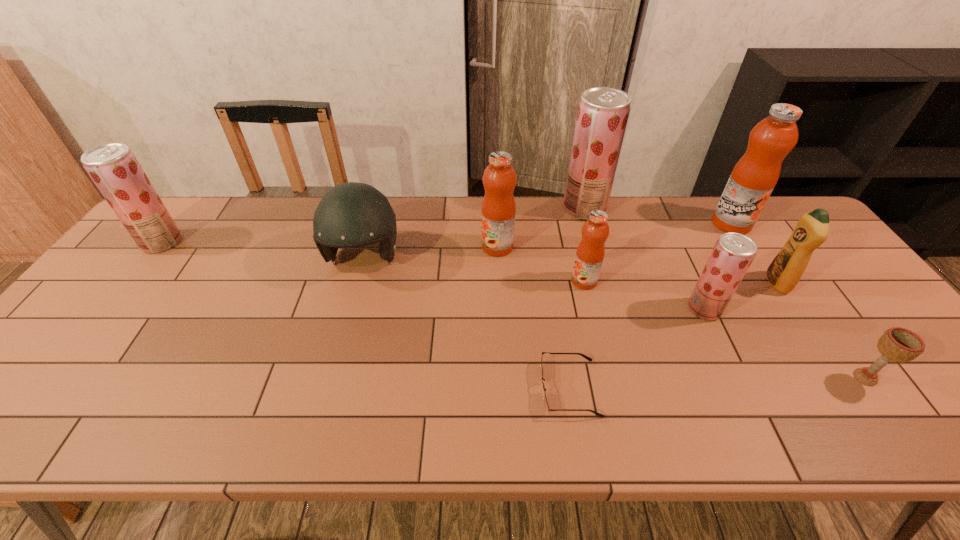
Identify the location of the second closest strawberry fruit juice to the second shortest object. This screenshot has height=540, width=960. (603, 112).

Locate an element on the screen. This screenshot has width=960, height=540. strawberry fruit juice that can be found as the closest to the fourth object from right to left is located at coordinates (603, 112).

Find the location of `orange fruit juice identified as the closest to the shortest object`. orange fruit juice identified as the closest to the shortest object is located at coordinates (590, 253).

Image resolution: width=960 pixels, height=540 pixels. I want to click on orange fruit juice object that ranks as the closest to the nearest fruit juice, so click(590, 253).

Locate an element on the screen. The width and height of the screenshot is (960, 540). vacant area in the image that satisfies the following two spatial constraints: 1. on the label of the beige chalice; 2. on the right side of the detergent is located at coordinates click(x=841, y=377).

What are the coordinates of `vacant space that satisfies the following two spatial constraints: 1. on the front label of the rightmost orange fruit juice; 2. on the front-facing side of the shortest object` in the screenshot? It's located at (838, 388).

Locate an element on the screen. free location that satisfies the following two spatial constraints: 1. on the front label of the rightmost fruit juice; 2. on the front-facing side of the shortest object is located at coordinates (838, 388).

The height and width of the screenshot is (540, 960). In order to click on vacant space that satisfies the following two spatial constraints: 1. on the front label of the leftmost orange fruit juice; 2. on the back side of the smallest strawberry fruit juice in this screenshot , I will do `click(500, 309)`.

You are a GUI agent. You are given a task and a screenshot of the screen. Output one action in this format:
    pyautogui.click(x=<x>, y=<y>)
    Task: Click on the free space that satisfies the following two spatial constraints: 1. on the front label of the second fruit juice from right to left; 2. on the left side of the second orange fruit juice from right to left
    The image size is (960, 540).
    Given the screenshot: What is the action you would take?
    click(x=590, y=309)